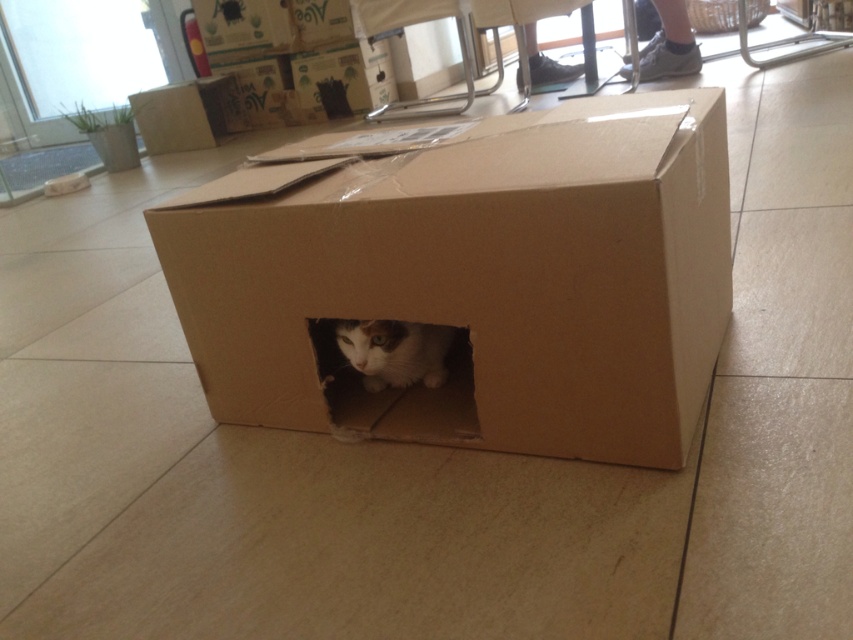
Is cardboard box at center shorter than white fur cat at center?

In fact, cardboard box at center may be taller than white fur cat at center.

Which of these two, cardboard box at center or white fur cat at center, stands shorter?

white fur cat at center is shorter.

Identify the location of cardboard box at center. (187, 115).

Locate an element on the screen. cardboard box at center is located at coordinates (187, 115).

Who is higher up, brown cardboard box at center or cardboard box at center?

cardboard box at center is above.

Locate an element on the screen. brown cardboard box at center is located at coordinates (474, 280).

In the scene shown: Does brown cardboard box at center appear over white fur cat at center?

Yes.

Which is more to the right, brown cardboard box at center or white fur cat at center?

Positioned to the right is brown cardboard box at center.

Between point (312, 225) and point (376, 364), which one is positioned behind?

Point (376, 364)

Where is `brown cardboard box at center`? brown cardboard box at center is located at coordinates pyautogui.click(x=474, y=280).